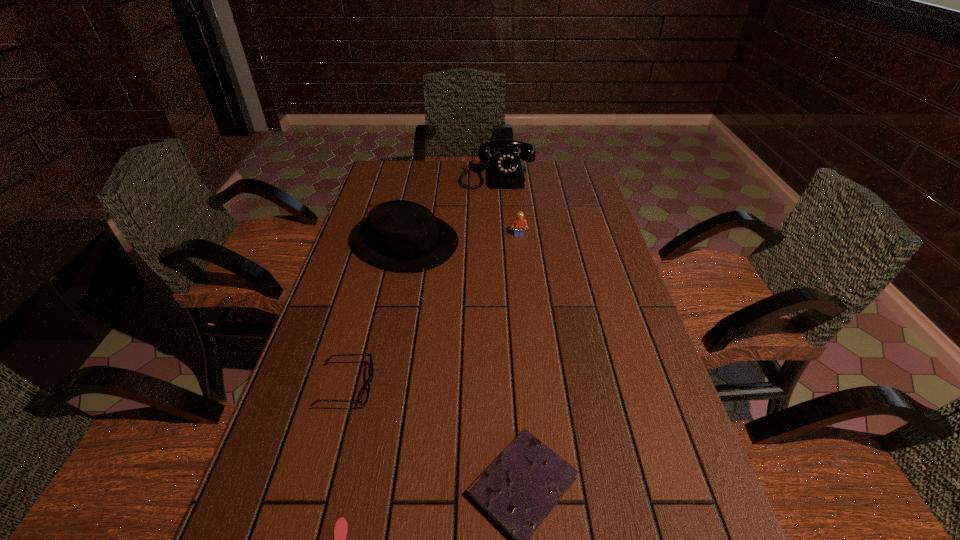
At what (x,y) coordinates should I click in order to perform the action: click on object positioned at the far edge. Please return your answer as a coordinate pair (x, y). The width and height of the screenshot is (960, 540). Looking at the image, I should click on (506, 170).

Where is `fedora that is at the left edge`? fedora that is at the left edge is located at coordinates (402, 235).

Where is `spectacles that is positioned at the left edge`? The width and height of the screenshot is (960, 540). spectacles that is positioned at the left edge is located at coordinates (365, 394).

The height and width of the screenshot is (540, 960). I want to click on free region at the far edge, so click(x=451, y=187).

The height and width of the screenshot is (540, 960). Identify the location of vacant space at the left edge of the desktop. (346, 431).

I want to click on free space at the right edge of the desktop, so click(656, 477).

Locate an element on the screen. The width and height of the screenshot is (960, 540). free space at the far left corner of the desktop is located at coordinates (397, 170).

I want to click on vacant area between the fifth shortest object and the third nearest object, so click(x=375, y=314).

Find the location of `empty space between the farthest object and the fourth farthest object`. empty space between the farthest object and the fourth farthest object is located at coordinates (421, 281).

Locate an element on the screen. unoccupied position between the third tallest object and the farthest object is located at coordinates (508, 205).